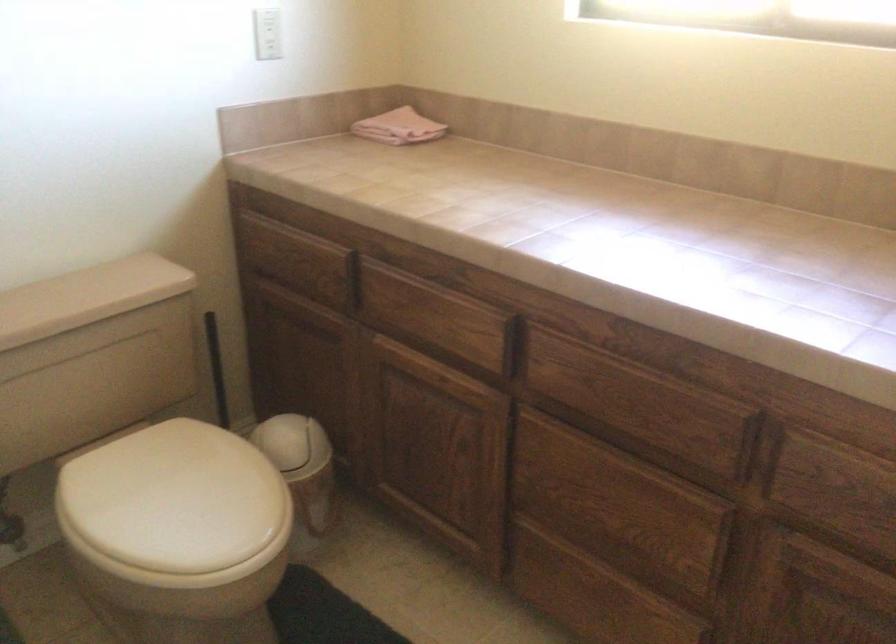
Find the location of a particular element. This screenshot has width=896, height=644. white trash can lid is located at coordinates (293, 444).